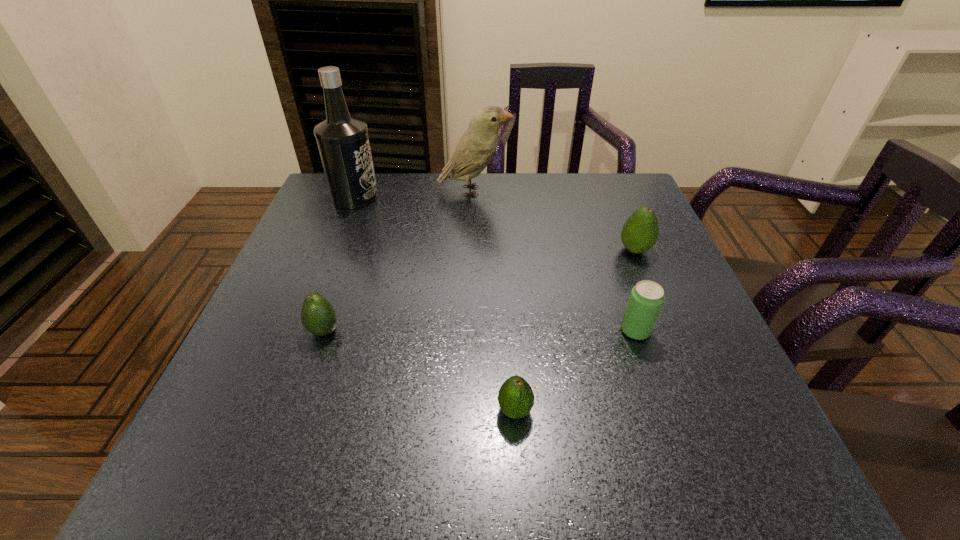
Identify the location of the third closest avocado to the fifth shortest object. (515, 397).

Locate an element on the screen. The width and height of the screenshot is (960, 540). free spot that satisfies the following two spatial constraints: 1. at the face of the nearest object; 2. on the right side of the bird is located at coordinates (469, 410).

Where is `free space that satisfies the following two spatial constraints: 1. at the face of the rightmost avocado; 2. on the left side of the bird`? Image resolution: width=960 pixels, height=540 pixels. free space that satisfies the following two spatial constraints: 1. at the face of the rightmost avocado; 2. on the left side of the bird is located at coordinates (473, 250).

The width and height of the screenshot is (960, 540). What are the coordinates of `vacant space that satisfies the following two spatial constraints: 1. on the front label of the second avocado from right to left; 2. on the left side of the liquor` in the screenshot? It's located at click(272, 410).

In order to click on blank area in the image that satisfies the following two spatial constraints: 1. on the front label of the tallest object; 2. on the left side of the leftmost avocado in this screenshot , I will do `click(302, 331)`.

In order to click on free spot that satisfies the following two spatial constraints: 1. on the front label of the tallest object; 2. on the left side of the second farthest avocado in this screenshot , I will do `click(302, 331)`.

Identify the location of free location that satisfies the following two spatial constraints: 1. at the face of the second tallest object; 2. on the right side of the second avocado from right to left. (469, 410).

The width and height of the screenshot is (960, 540). Find the location of `blank area in the image that satisfies the following two spatial constraints: 1. at the face of the fifth shortest object; 2. on the left side of the soda`. blank area in the image that satisfies the following two spatial constraints: 1. at the face of the fifth shortest object; 2. on the left side of the soda is located at coordinates (471, 330).